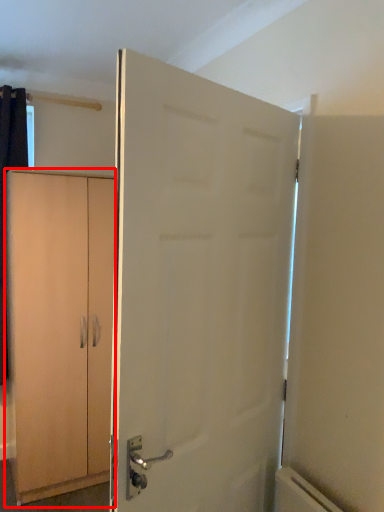
Question: In this image, where is cabinetry (annotated by the red box) located relative to door?

Choices:
 (A) left
 (B) right

Answer: (A)